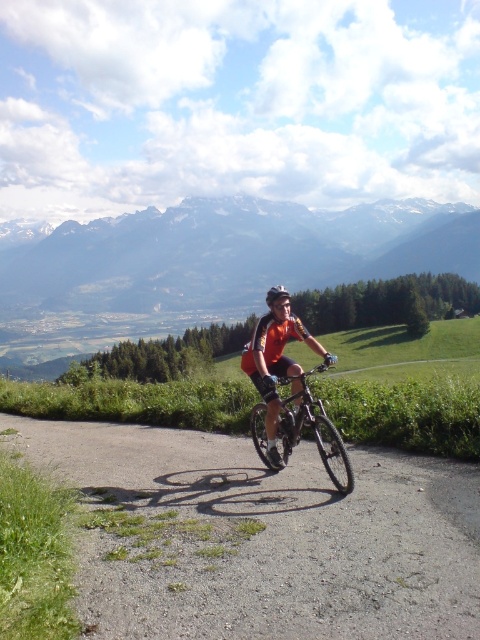
Question: Can you confirm if shiny metallic bicycle at center is bigger than matte black helmet at center?

Choices:
 (A) yes
 (B) no

Answer: (B)

Question: Which object appears farthest from the camera in this image?

Choices:
 (A) snowy mountain range at upper center
 (B) shiny metallic bicycle at center

Answer: (A)

Question: Can you confirm if snowy mountain range at upper center is positioned above shiny metallic bicycle at center?

Choices:
 (A) no
 (B) yes

Answer: (B)

Question: Which point is closer to the camera?

Choices:
 (A) (340, 440)
 (B) (276, 294)
 (C) (168, 284)
 (D) (380, 566)

Answer: (D)

Question: Which object is closer to the camera taking this photo?

Choices:
 (A) matte black helmet at center
 (B) gray asphalt road at center

Answer: (B)

Question: Can you confirm if gray asphalt road at center is positioned to the left of snowy mountain range at upper center?

Choices:
 (A) no
 (B) yes

Answer: (A)